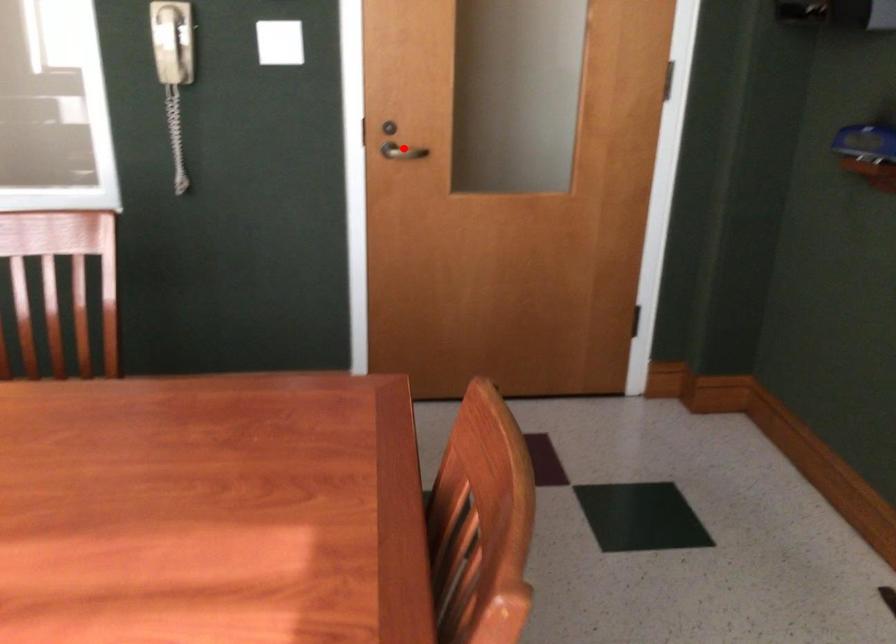
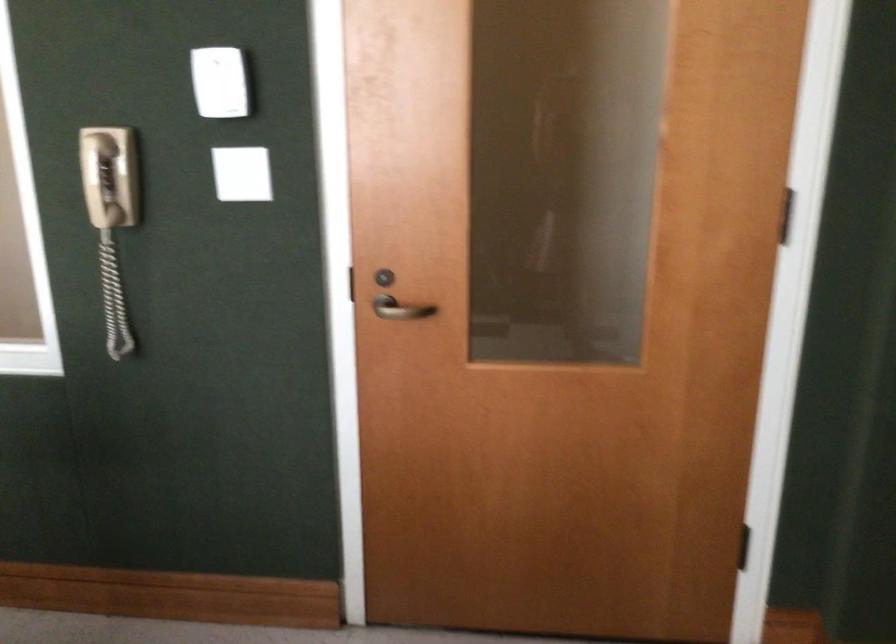
Question: I am providing you with two images of the same scene from different viewpoints. Image1 has a red point marked. In image2, the corresponding 3D location appears at what relative position? Reply with the corresponding letter.

Choices:
 (A) Closer
 (B) Farther

Answer: (A)